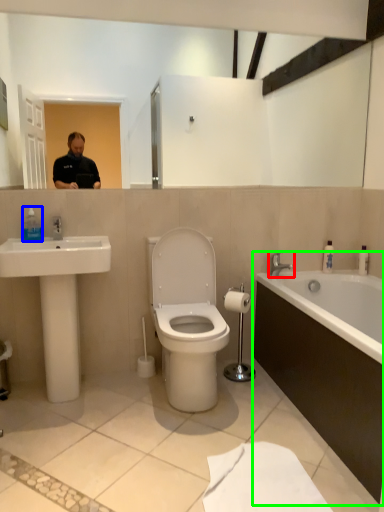
Question: Estimate the real-world distances between objects in this image. Which object is farther from tap (highlighted by a red box), soap dispenser (highlighted by a blue box) or bathtub (highlighted by a green box)?

Choices:
 (A) soap dispenser
 (B) bathtub

Answer: (A)